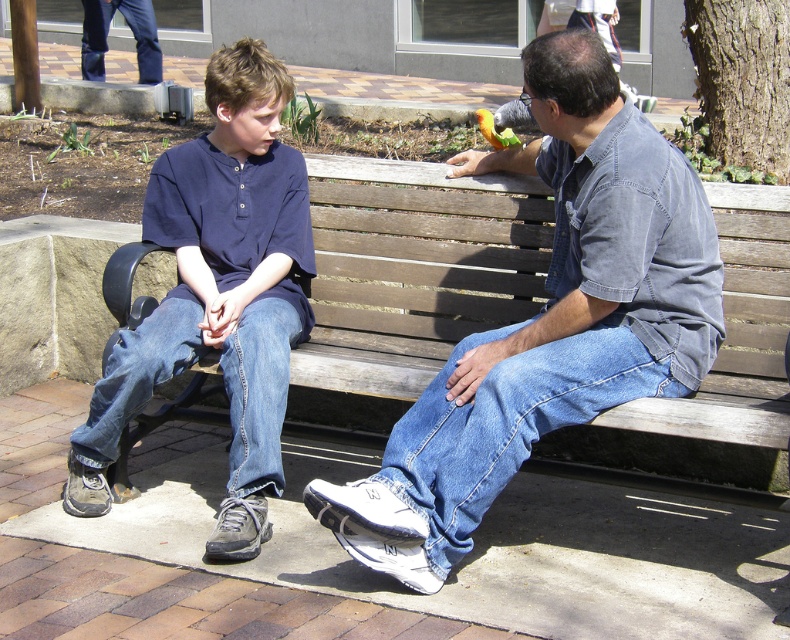
You are standing at the origin point of the coordinate system, which is at the bottom left corner of the image. The wooden bench at center is located at point (412, 268). If you want to walk directly to the wooden bench at center, in which direction should you move relative to your current position?

Since the wooden bench at center is located at point (412, 268) in the coordinate system, you should move northeast to reach it from the origin at the bottom left corner.

You are a tailor measuring the length of two pairs of jeans for alterations. You have a denim jeans at center and a dark blue jeans at upper left. Which pair of jeans is taller?

The denim jeans at center is taller than the dark blue jeans at upper left according to the description.